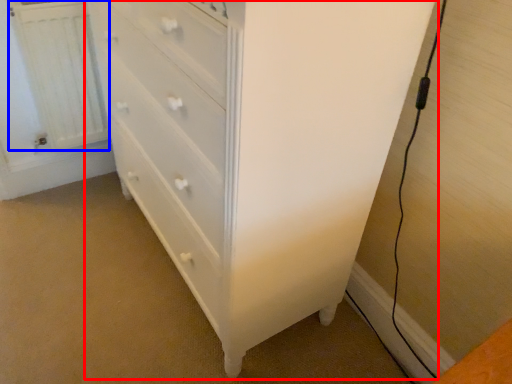
Question: Among these objects, which one is nearest to the camera, chest of drawers (highlighted by a red box) or radiator (highlighted by a blue box)?

Choices:
 (A) chest of drawers
 (B) radiator

Answer: (A)